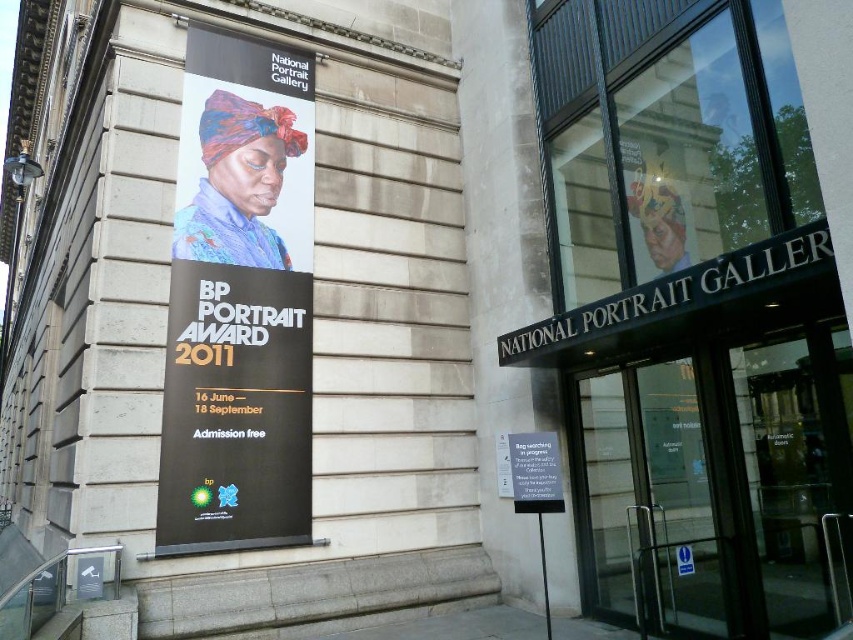
From the picture: Between matte black banner at upper left and white plastic sign at center, which one appears on the left side from the viewer's perspective?

matte black banner at upper left

This screenshot has width=853, height=640. What do you see at coordinates (239, 301) in the screenshot?
I see `matte black banner at upper left` at bounding box center [239, 301].

Identify the location of matte black banner at upper left. (239, 301).

Which is behind, point (727, 540) or point (515, 484)?

Point (515, 484)

Who is positioned more to the left, transparent glass door at center or white plastic sign at center?

Positioned to the left is white plastic sign at center.

Where is `transparent glass door at center`? The width and height of the screenshot is (853, 640). transparent glass door at center is located at coordinates (653, 506).

This screenshot has height=640, width=853. What are the coordinates of `transparent glass door at center` in the screenshot? It's located at (653, 506).

Can you confirm if matte black banner at upper left is positioned above transparent glass door at center?

Yes.

Can you confirm if matte black banner at upper left is positioned to the right of transparent glass door at center?

No, matte black banner at upper left is not to the right of transparent glass door at center.

Who is more forward, (x=259, y=241) or (x=592, y=497)?

Positioned in front is point (x=592, y=497).

Image resolution: width=853 pixels, height=640 pixels. What are the coordinates of `matte black banner at upper left` in the screenshot? It's located at (239, 301).